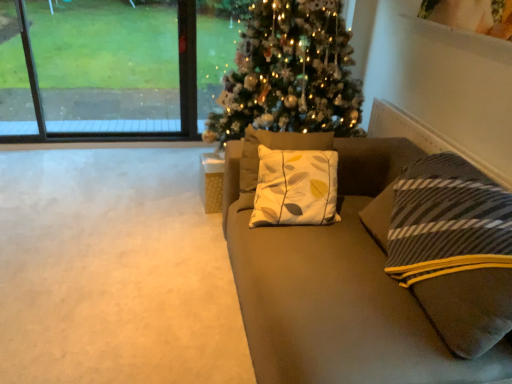
The height and width of the screenshot is (384, 512). Find the location of `blank space to the left of wooden cube at center`. blank space to the left of wooden cube at center is located at coordinates (179, 200).